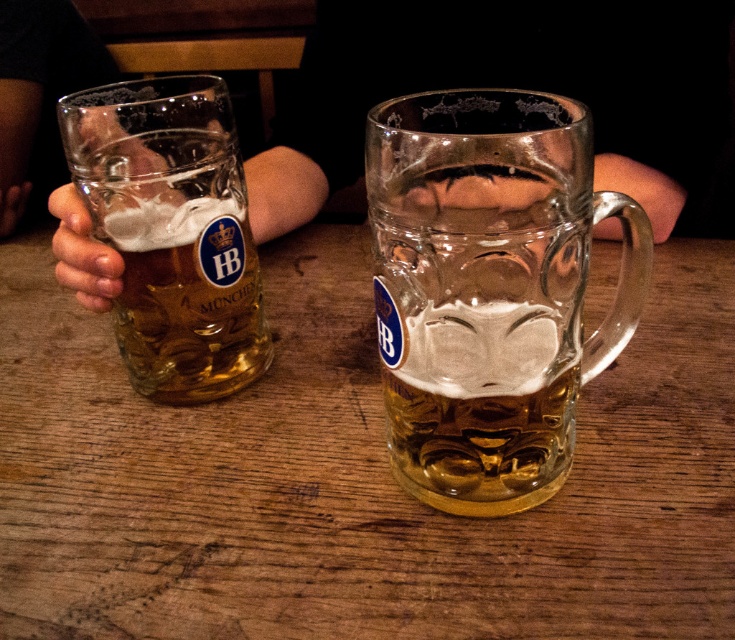
Question: Which object appears farthest from the camera in this image?

Choices:
 (A) wooden table at center
 (B) smooth skin hand at left

Answer: (B)

Question: Can you confirm if wooden table at center is thinner than translucent glass mug at left?

Choices:
 (A) no
 (B) yes

Answer: (A)

Question: Can you confirm if wooden table at center is positioned above translucent glass mug at left?

Choices:
 (A) no
 (B) yes

Answer: (A)

Question: Which of these objects is positioned farthest from the smooth skin hand at left?

Choices:
 (A) clear glass mug at center
 (B) wooden table at center

Answer: (B)

Question: Does translucent glass mug at left appear over smooth skin hand at left?

Choices:
 (A) yes
 (B) no

Answer: (A)

Question: Which point is farther from the camera taking this photo?

Choices:
 (A) (212, 154)
 (B) (62, 212)
 (C) (290, 572)

Answer: (B)